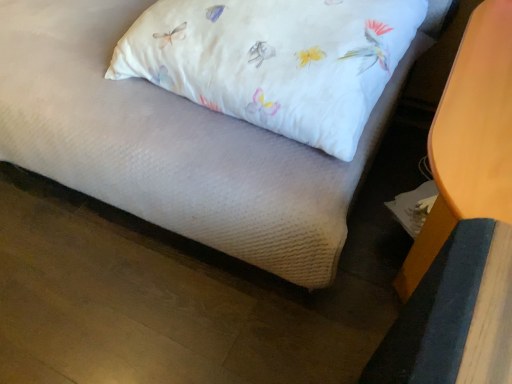
Question: Can you confirm if white fabric pillow at upper center is smaller than matte wood table at lower right?

Choices:
 (A) no
 (B) yes

Answer: (B)

Question: Considering the relative sizes of white fabric pillow at upper center and matte wood table at lower right in the image provided, is white fabric pillow at upper center bigger than matte wood table at lower right?

Choices:
 (A) no
 (B) yes

Answer: (A)

Question: Is white fabric pillow at upper center taller than matte wood table at lower right?

Choices:
 (A) yes
 (B) no

Answer: (B)

Question: Does white fabric pillow at upper center appear on the left side of matte wood table at lower right?

Choices:
 (A) yes
 (B) no

Answer: (A)

Question: Does white fabric pillow at upper center come behind matte wood table at lower right?

Choices:
 (A) no
 (B) yes

Answer: (B)

Question: Does white fabric pillow at upper center lie in front of matte wood table at lower right?

Choices:
 (A) yes
 (B) no

Answer: (B)

Question: From the image's perspective, is matte wood table at lower right under white fabric pillow at upper center?

Choices:
 (A) yes
 (B) no

Answer: (A)

Question: Is matte wood table at lower right positioned with its back to white fabric pillow at upper center?

Choices:
 (A) yes
 (B) no

Answer: (B)

Question: Is matte wood table at lower right taller than white fabric pillow at upper center?

Choices:
 (A) no
 (B) yes

Answer: (B)

Question: Considering the relative sizes of matte wood table at lower right and white fabric pillow at upper center in the image provided, is matte wood table at lower right wider than white fabric pillow at upper center?

Choices:
 (A) yes
 (B) no

Answer: (B)

Question: Is matte wood table at lower right positioned behind white fabric pillow at upper center?

Choices:
 (A) yes
 (B) no

Answer: (B)

Question: From a real-world perspective, is matte wood table at lower right located beneath white fabric pillow at upper center?

Choices:
 (A) no
 (B) yes

Answer: (B)

Question: In terms of height, does matte wood table at lower right look taller or shorter compared to white fabric pillow at upper center?

Choices:
 (A) tall
 (B) short

Answer: (A)